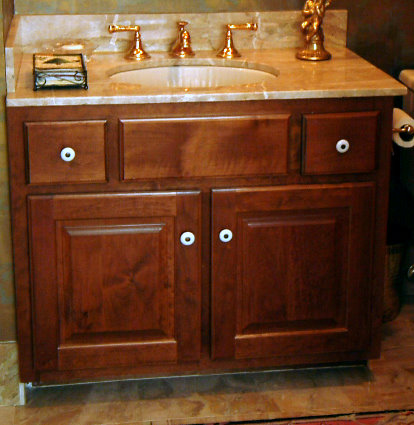
Identify the location of hot and cold water handles. [x=126, y=28], [x=239, y=25].